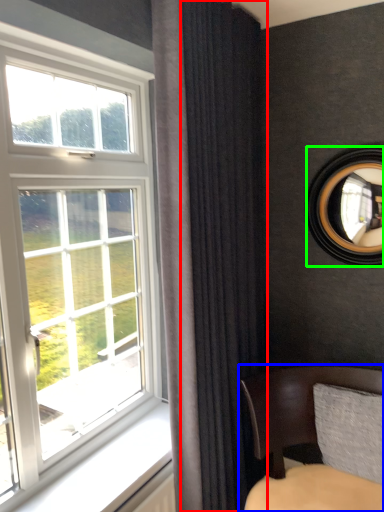
Question: Considering the real-world distances, which object is closest to curtain (highlighted by a red box)? chair (highlighted by a blue box) or mirror (highlighted by a green box).

Choices:
 (A) chair
 (B) mirror

Answer: (A)